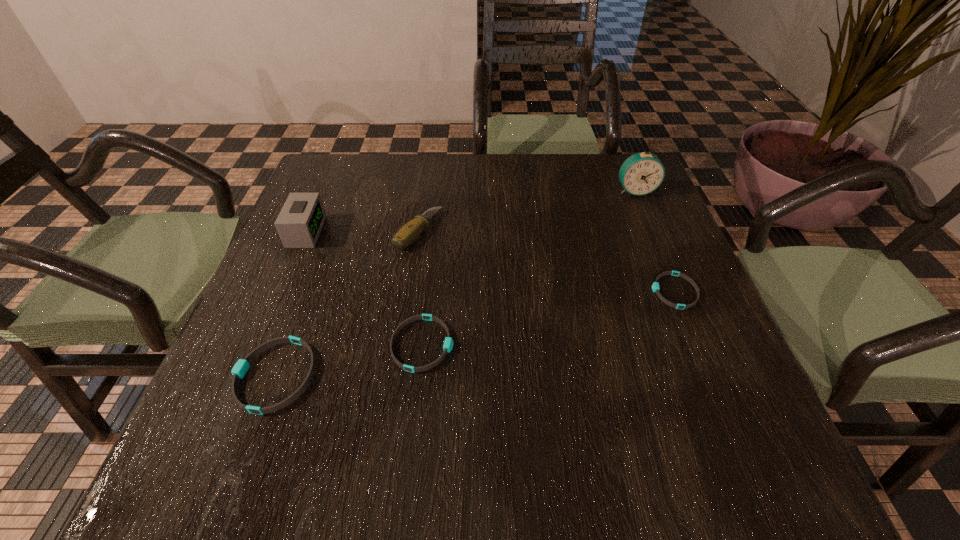
Locate an element on the screen. object that can be found as the third closest to the pocketknife is located at coordinates (239, 370).

I want to click on the fifth closest object to the shorter alarm clock, so click(655, 286).

Select which wristband appears as the third closest to the right alarm clock. Please provide its 2D coordinates. Your answer should be formatted as a tuple, i.e. [(x, y)], where the tuple contains the x and y coordinates of a point satisfying the conditions above.

[(239, 370)]

You are a GUI agent. You are given a task and a screenshot of the screen. Output one action in this format:
    pyautogui.click(x=<x>, y=<y>)
    Task: Click on the wristband that is the nearest to the second wristband from left to right
    Image resolution: width=960 pixels, height=540 pixels.
    Given the screenshot: What is the action you would take?
    [239, 370]

This screenshot has width=960, height=540. I want to click on free location that satisfies the following two spatial constraints: 1. on the front-facing side of the right alarm clock; 2. on the buckle of the shortest object, so click(678, 291).

Locate an element on the screen. This screenshot has width=960, height=540. free point that satisfies the following two spatial constraints: 1. on the front-facing side of the right alarm clock; 2. on the buckle of the shortest wristband is located at coordinates (678, 291).

Image resolution: width=960 pixels, height=540 pixels. What are the coordinates of `vacant space that satisfies the following two spatial constraints: 1. on the front-facing side of the farther alarm clock; 2. on the front-facing side of the shorter alarm clock` in the screenshot? It's located at (653, 232).